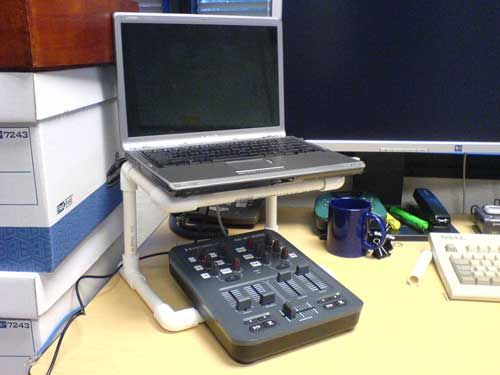
At what (x,y) coordinates should I click in order to perform the action: click on white file box. Please return your answer as a coordinate pair (x, y). Looking at the image, I should click on (20, 328), (23, 173).